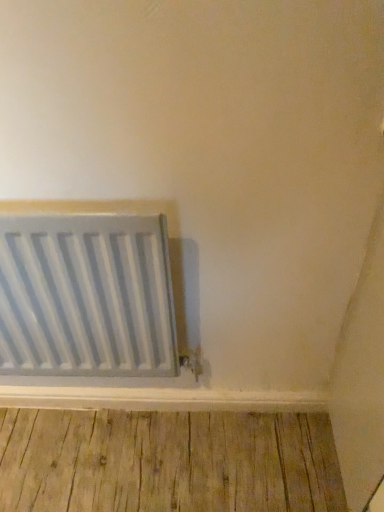
Where is `empty space that is ontop of natural wood floor at bottom (from a real-world perspective)`? The height and width of the screenshot is (512, 384). empty space that is ontop of natural wood floor at bottom (from a real-world perspective) is located at coordinates (151, 453).